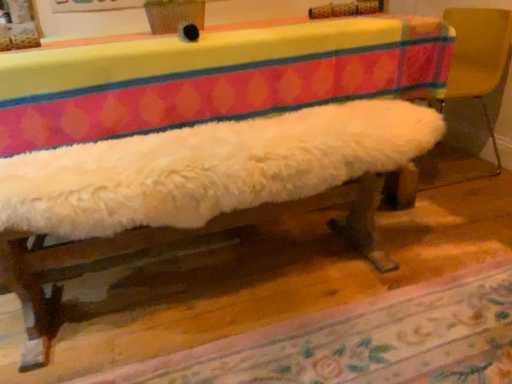
What are the coordinates of `free space in front of white fluffy cushion at right` in the screenshot? It's located at (456, 207).